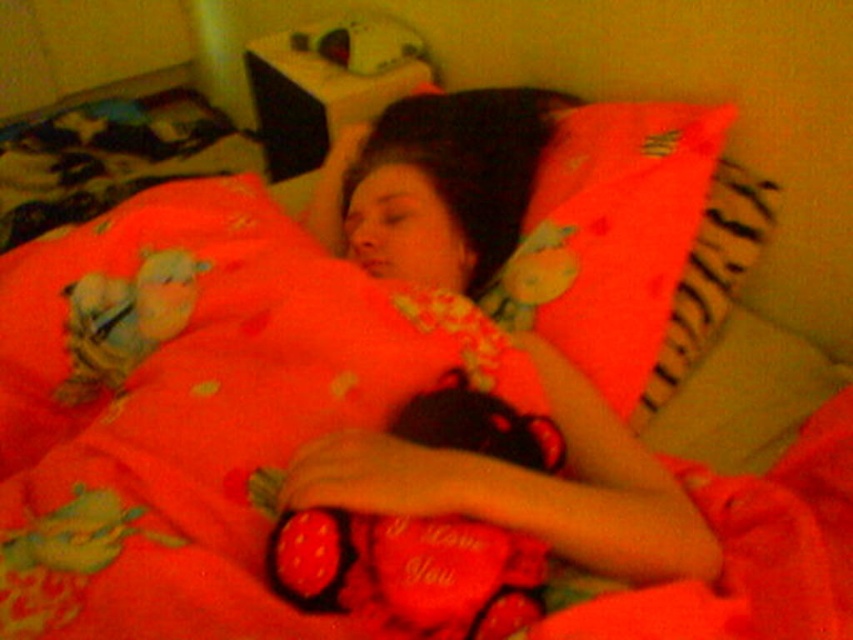
Question: Can you confirm if matte fabric woman at center is positioned above fluffy fabric pillow at upper right?

Choices:
 (A) yes
 (B) no

Answer: (B)

Question: Is matte fabric woman at center thinner than soft plush toy at upper left?

Choices:
 (A) yes
 (B) no

Answer: (B)

Question: Which is nearer to the soft plush toy at upper left?

Choices:
 (A) velvet plush heart at center
 (B) matte fabric woman at center
 (C) fluffy fabric pillow at upper right

Answer: (B)

Question: Which of the following is the farthest from the observer?

Choices:
 (A) soft plush toy at upper left
 (B) matte fabric woman at center

Answer: (A)

Question: Which point is closer to the camera taking this photo?

Choices:
 (A) tap(462, 632)
 (B) tap(82, 276)

Answer: (A)

Question: Can you confirm if matte fabric woman at center is bigger than zebra-patterned pillow at upper right?

Choices:
 (A) no
 (B) yes

Answer: (B)